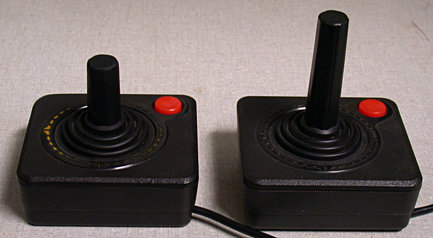
The width and height of the screenshot is (433, 238). I want to click on empty space on carpet above controllers, so click(x=212, y=30).